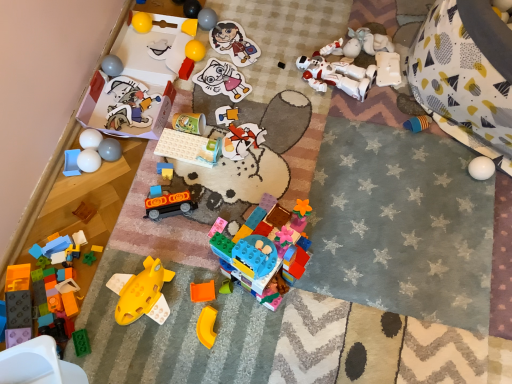
Find the location of a particular element. This screenshot has width=512, height=384. vacant area that lies between yellow matte block at center, which is counted as the eleventh toy, starting from the left, and matte plastic blocks at center, the 9th toy viewed from the left is located at coordinates (176, 105).